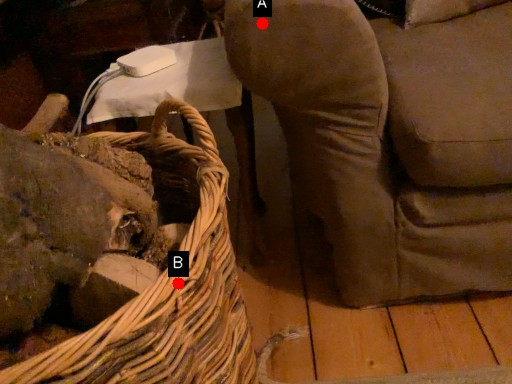
Question: Two points are circled on the image, labeled by A and B beside each circle. Which of the following is the farthest from the observer?

Choices:
 (A) A is further
 (B) B is further

Answer: (A)